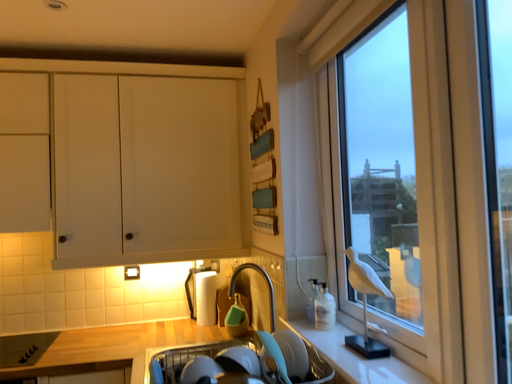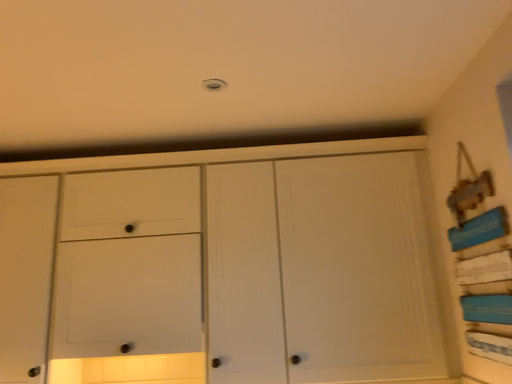
Question: Which way did the camera rotate in the video?

Choices:
 (A) rotated downward
 (B) rotated upward

Answer: (B)